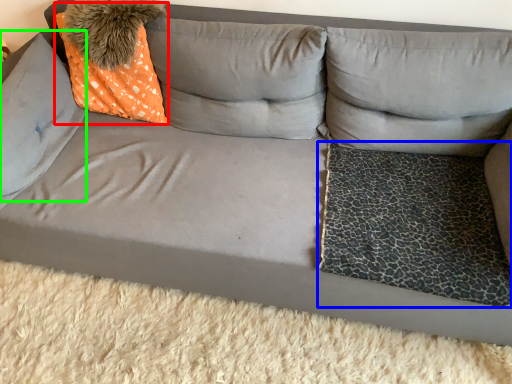
Question: Which object is positioned closest to throw pillow (highlighted by a red box)? Select from dog bed (highlighted by a blue box) and pillow (highlighted by a green box).

Choices:
 (A) dog bed
 (B) pillow

Answer: (B)